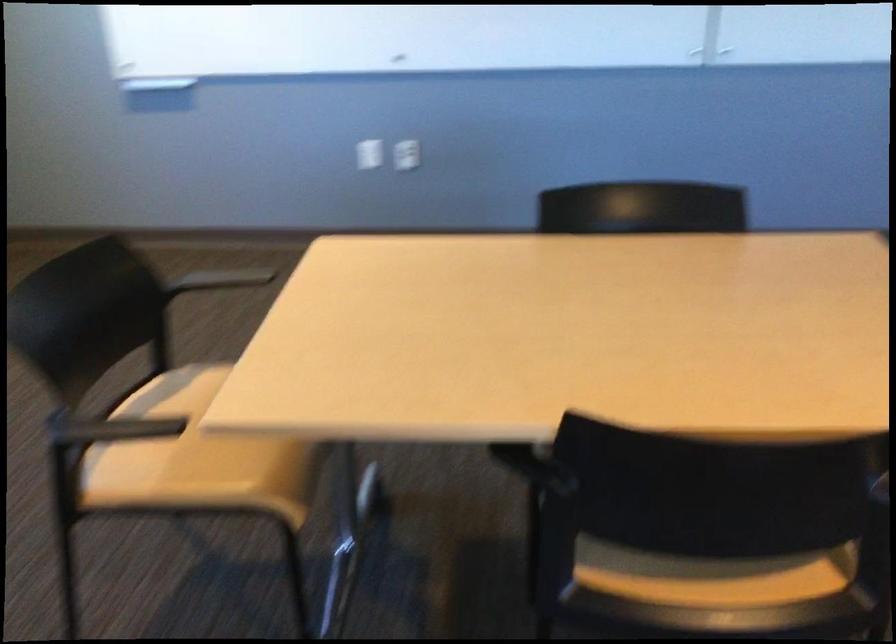
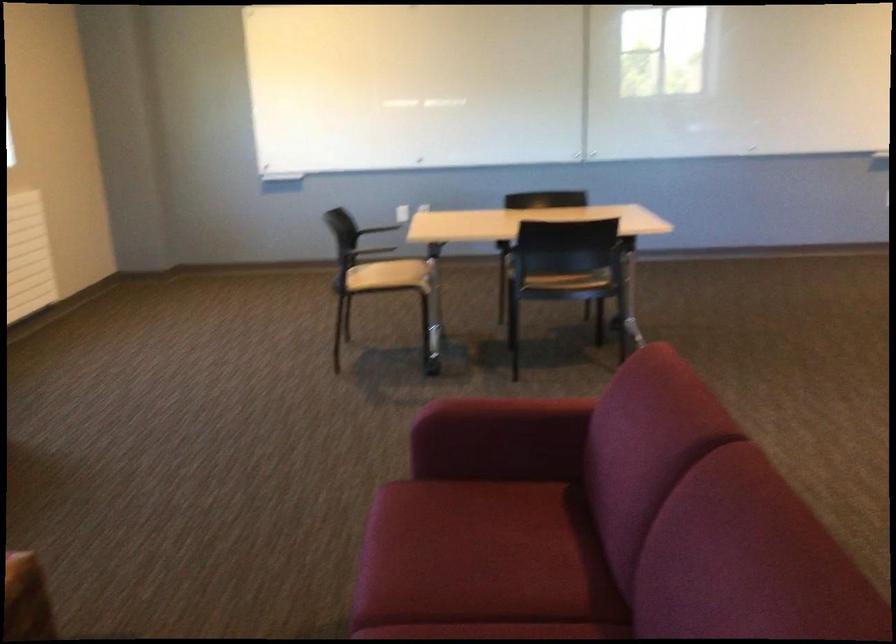
In the second image, find the point that corresponds to (x=666, y=562) in the first image.

(566, 281)